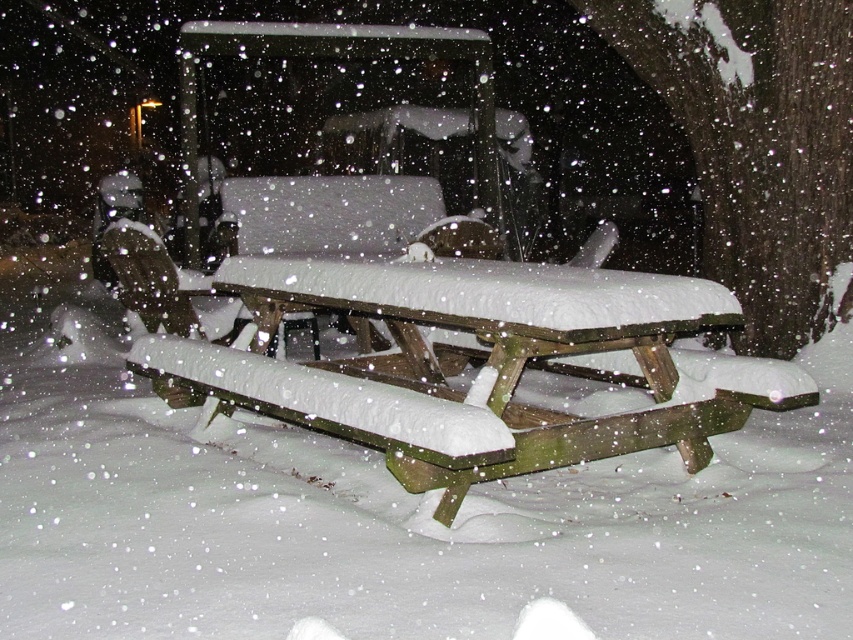
Is wooden picnic table at center to the left of snow-covered wood park bench at center from the viewer's perspective?

Incorrect, wooden picnic table at center is not on the left side of snow-covered wood park bench at center.

Can you confirm if wooden picnic table at center is smaller than snow-covered wood park bench at center?

No.

Is point (340, 294) closer to viewer compared to point (320, 208)?

Yes, it is in front of point (320, 208).

The height and width of the screenshot is (640, 853). I want to click on wooden picnic table at center, so click(x=485, y=364).